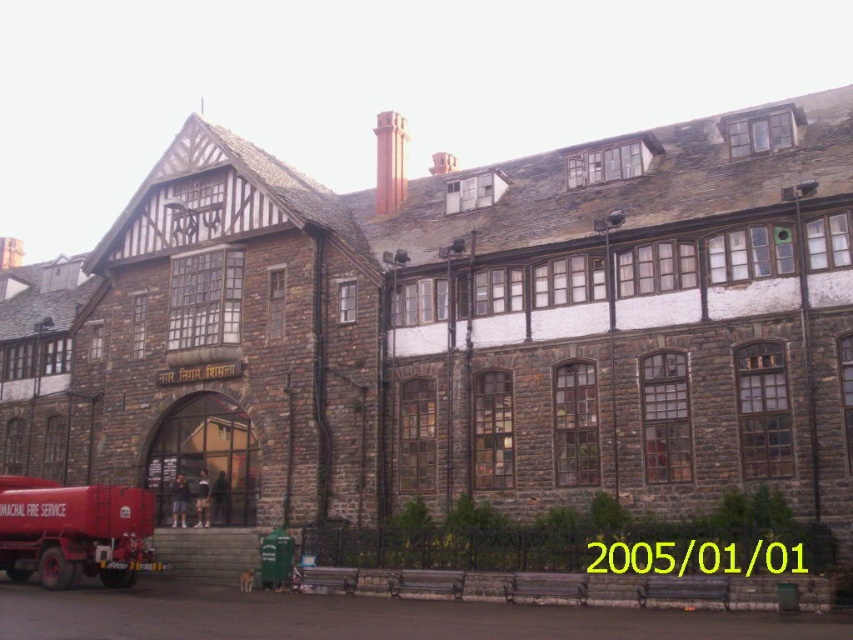
Question: Which object appears closest to the camera in this image?

Choices:
 (A) matte red truck at lower left
 (B) red brick chimney at upper center

Answer: (A)

Question: Is matte red truck at lower left thinner than red brick chimney at upper center?

Choices:
 (A) yes
 (B) no

Answer: (B)

Question: Does matte red truck at lower left have a greater width compared to red brick chimney at upper center?

Choices:
 (A) yes
 (B) no

Answer: (A)

Question: Is matte red truck at lower left above red brick chimney at upper center?

Choices:
 (A) no
 (B) yes

Answer: (A)

Question: Which of the following is the farthest from the observer?

Choices:
 (A) (x=389, y=132)
 (B) (x=103, y=490)

Answer: (A)